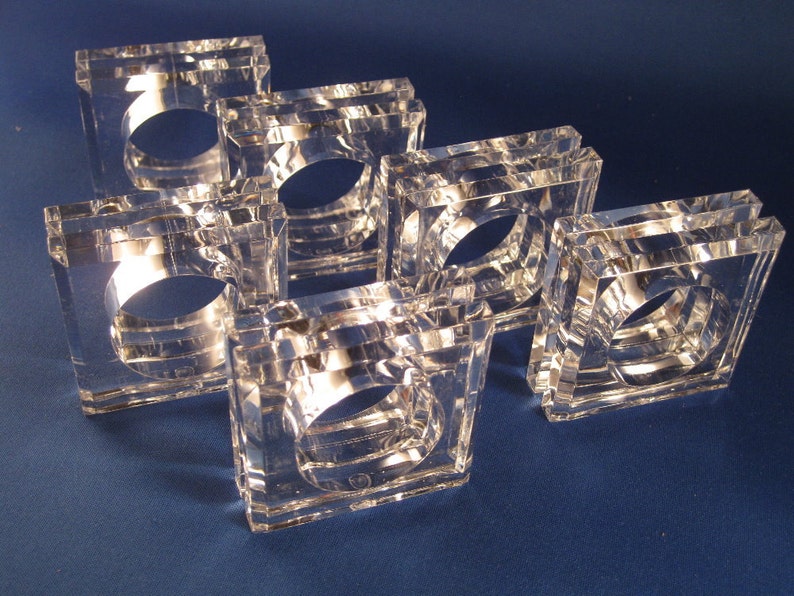
The height and width of the screenshot is (596, 794). I want to click on glass objects, so click(x=241, y=254), click(x=194, y=82), click(x=313, y=127), click(x=478, y=204), click(x=671, y=252).